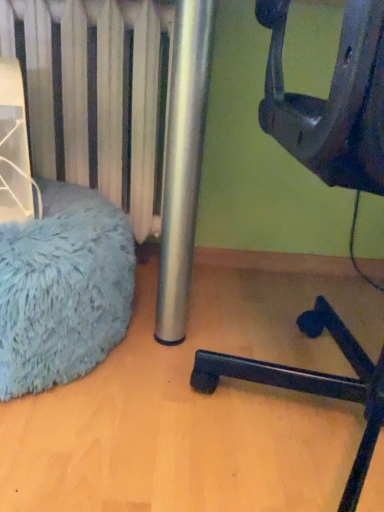
Describe the element at coordinates (63, 289) in the screenshot. This screenshot has height=512, width=384. I see `blue fuzzy bean bag at left` at that location.

What are the coordinates of `blue fuzzy bean bag at left` in the screenshot? It's located at (63, 289).

Measure the distance between point (50, 351) and camera.

Point (50, 351) and camera are 29.72 inches apart from each other.

The image size is (384, 512). What do you see at coordinates (332, 102) in the screenshot?
I see `black plastic chair at lower right` at bounding box center [332, 102].

Identify the location of black plastic chair at lower right. The image size is (384, 512). (332, 102).

You are a GUI agent. You are given a task and a screenshot of the screen. Output one action in this format:
    pyautogui.click(x=<x>, y=<y>)
    Task: Click on the blue fuzzy bean bag at left
    
    Given the screenshot: What is the action you would take?
    pyautogui.click(x=63, y=289)

Which is more to the left, blue fuzzy bean bag at left or black plastic chair at lower right?

From the viewer's perspective, blue fuzzy bean bag at left appears more on the left side.

Does blue fuzzy bean bag at left lie in front of black plastic chair at lower right?

No, it is not.

Between point (5, 348) and point (297, 118), which one is positioned in front?

Point (297, 118)

From the image's perspective, does blue fuzzy bean bag at left appear higher than black plastic chair at lower right?

No.

From a real-world perspective, who is located higher, blue fuzzy bean bag at left or black plastic chair at lower right?

black plastic chair at lower right.

Can you confirm if blue fuzzy bean bag at left is thinner than black plastic chair at lower right?

Correct, the width of blue fuzzy bean bag at left is less than that of black plastic chair at lower right.

Who is shorter, blue fuzzy bean bag at left or black plastic chair at lower right?

blue fuzzy bean bag at left.

Between blue fuzzy bean bag at left and black plastic chair at lower right, which one has larger size?

black plastic chair at lower right.

Is blue fuzzy bean bag at left completely or partially outside of black plastic chair at lower right?

blue fuzzy bean bag at left lies outside black plastic chair at lower right's area.

Is blue fuzzy bean bag at left next to black plastic chair at lower right and touching it?

No, blue fuzzy bean bag at left is not in contact with black plastic chair at lower right.

Is blue fuzzy bean bag at left facing away from black plastic chair at lower right?

No.

Find the location of a particular element. bean bag chair that appears below the black plastic chair at lower right (from the image's perspective) is located at coordinates (63, 289).

Considering the relative positions of black plastic chair at lower right and blue fuzzy bean bag at left in the image provided, is black plastic chair at lower right to the left of blue fuzzy bean bag at left from the viewer's perspective?

No.

Is black plastic chair at lower right closer to the viewer compared to blue fuzzy bean bag at left?

Yes, black plastic chair at lower right is closer to the camera.

Does point (344, 327) come in front of point (32, 260)?

No, it is not.

From the image's perspective, is black plastic chair at lower right located beneath blue fuzzy bean bag at left?

Actually, black plastic chair at lower right appears above blue fuzzy bean bag at left in the image.

From a real-world perspective, who is located higher, black plastic chair at lower right or blue fuzzy bean bag at left?

In real-world perspective, black plastic chair at lower right is above.

Is black plastic chair at lower right wider or thinner than blue fuzzy bean bag at left?

Considering their sizes, black plastic chair at lower right looks broader than blue fuzzy bean bag at left.

Between black plastic chair at lower right and blue fuzzy bean bag at left, which one has more height?

black plastic chair at lower right is taller.

Which of these two, black plastic chair at lower right or blue fuzzy bean bag at left, is bigger?

With larger size is black plastic chair at lower right.

Would you say blue fuzzy bean bag at left is part of black plastic chair at lower right's contents?

No.

Is the surface of black plastic chair at lower right in direct contact with blue fuzzy bean bag at left?

No, black plastic chair at lower right is not touching blue fuzzy bean bag at left.

Is black plastic chair at lower right positioned with its back to blue fuzzy bean bag at left?

That's not correct — black plastic chair at lower right is not looking away from blue fuzzy bean bag at left.

Consider the image. Measure the distance from black plastic chair at lower right to blue fuzzy bean bag at left.

They are 12.27 inches apart.

Identify the location of furniture lying on the right of blue fuzzy bean bag at left. (332, 102).

Where is `furniture above the blue fuzzy bean bag at left (from a real-world perspective)`? The width and height of the screenshot is (384, 512). furniture above the blue fuzzy bean bag at left (from a real-world perspective) is located at coordinates (332, 102).

Where is `furniture located above the blue fuzzy bean bag at left (from the image's perspective)`? The width and height of the screenshot is (384, 512). furniture located above the blue fuzzy bean bag at left (from the image's perspective) is located at coordinates (332, 102).